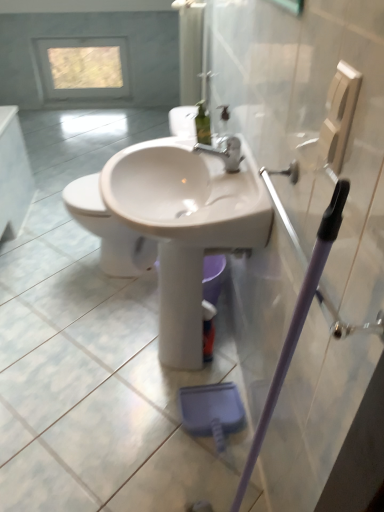
Question: From a real-world perspective, relative to transparent glass window at upper center, is white glossy sink at center vertically above or below?

Choices:
 (A) below
 (B) above

Answer: (B)

Question: Is white glossy sink at center situated inside transparent glass window at upper center or outside?

Choices:
 (A) inside
 (B) outside

Answer: (B)

Question: Which is nearer to the white glossy toilet at center?

Choices:
 (A) transparent plastic screen door at upper right
 (B) transparent glass window at upper center
 (C) white glossy sink at center

Answer: (C)

Question: Which is farther from the white glossy sink at center?

Choices:
 (A) white glossy toilet at center
 (B) transparent glass window at upper center
 (C) transparent plastic screen door at upper right

Answer: (B)